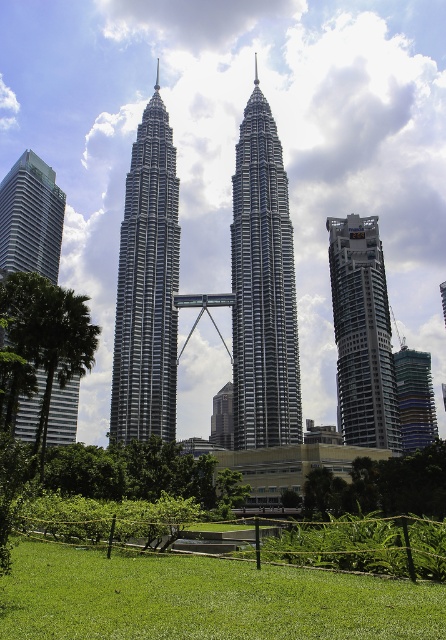
Can you confirm if green grass at lower center is taller than green leafy tree at left?

No, green grass at lower center is not taller than green leafy tree at left.

Is point (29, 566) farther from viewer compared to point (21, 301)?

No.

Is point (103, 604) farther from camera compared to point (8, 316)?

No, (103, 604) is in front of (8, 316).

You are a GUI agent. You are given a task and a screenshot of the screen. Output one action in this format:
    pyautogui.click(x=<x>, y=<y>)
    Task: Click on the green grass at lower center
    The image size is (446, 640).
    Given the screenshot: What is the action you would take?
    [x=202, y=600]

Looking at this image, is silver metallic skyscraper at right taller than green leafy tree at left?

Correct, silver metallic skyscraper at right is much taller as green leafy tree at left.

Where is `silver metallic skyscraper at right`? The height and width of the screenshot is (640, 446). silver metallic skyscraper at right is located at coordinates (362, 333).

The width and height of the screenshot is (446, 640). I want to click on silver metallic skyscraper at right, so tap(362, 333).

Does green glass building at lower right have a lesser height compared to glassy reflective building at center?

No.

Between point (433, 417) and point (227, 445), which one is positioned in front?

Point (227, 445)

Who is more forward, (429, 356) or (213, 442)?

Point (213, 442) is in front.

The width and height of the screenshot is (446, 640). I want to click on green glass building at lower right, so click(x=414, y=397).